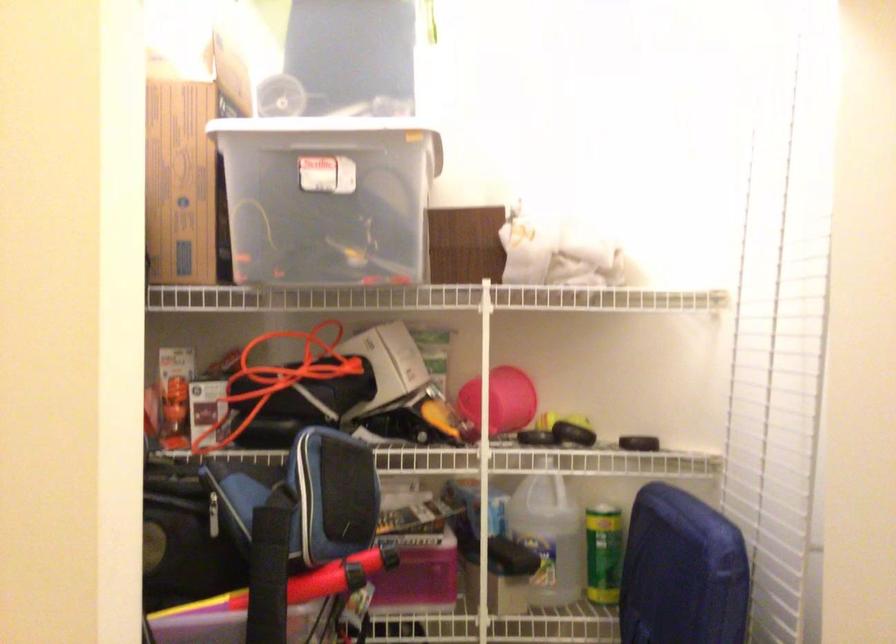
The height and width of the screenshot is (644, 896). Find the location of `red tool handle`. red tool handle is located at coordinates (298, 583).